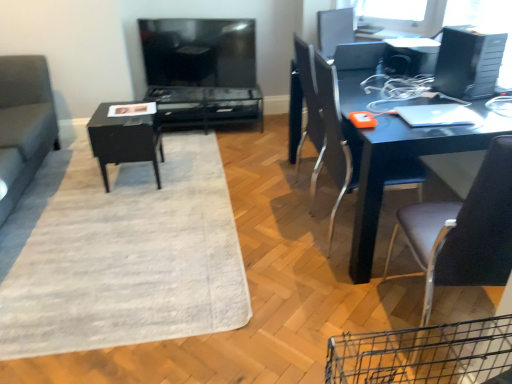
Locate an element on the screen. free region on the left part of leather-like brown chair at right, which appears as the 1th chair when viewed from the front is located at coordinates (330, 312).